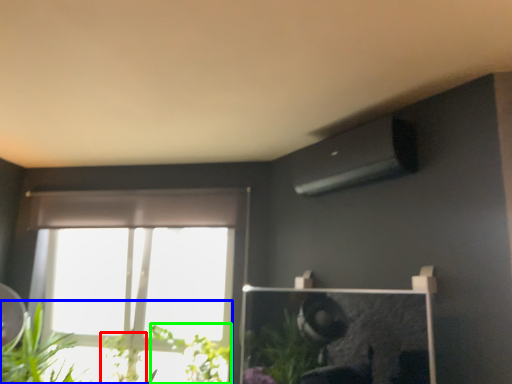
Question: Considering the real-world distances, which object is farthest from plant (highlighted by a red box)? houseplant (highlighted by a blue box) or plant (highlighted by a green box)?

Choices:
 (A) houseplant
 (B) plant

Answer: (A)